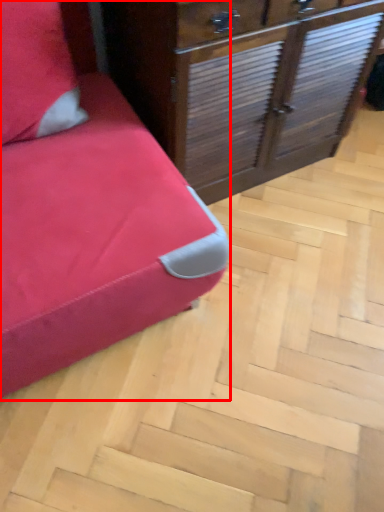
Question: In this image, where is furniture (annotated by the red box) located relative to chest of drawers?

Choices:
 (A) left
 (B) right

Answer: (A)